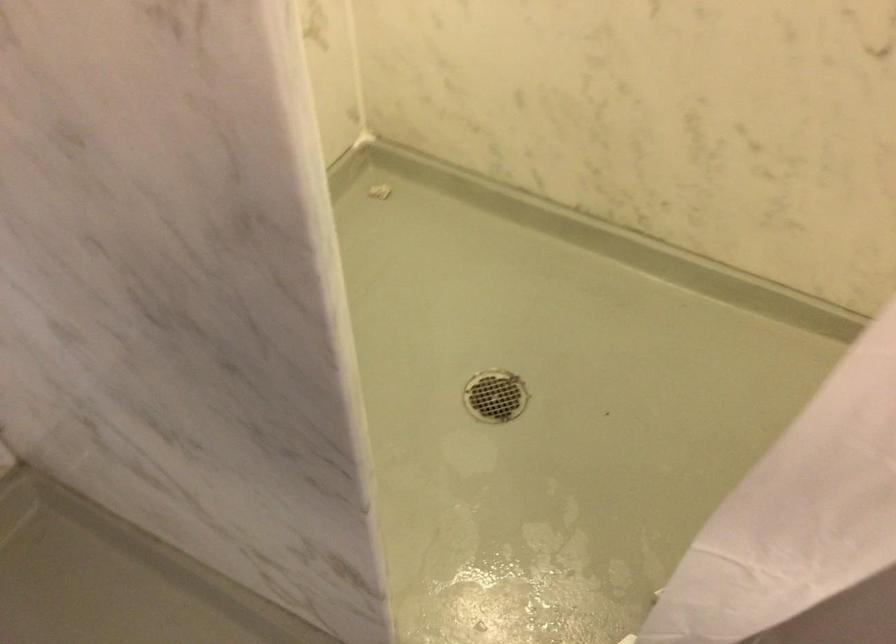
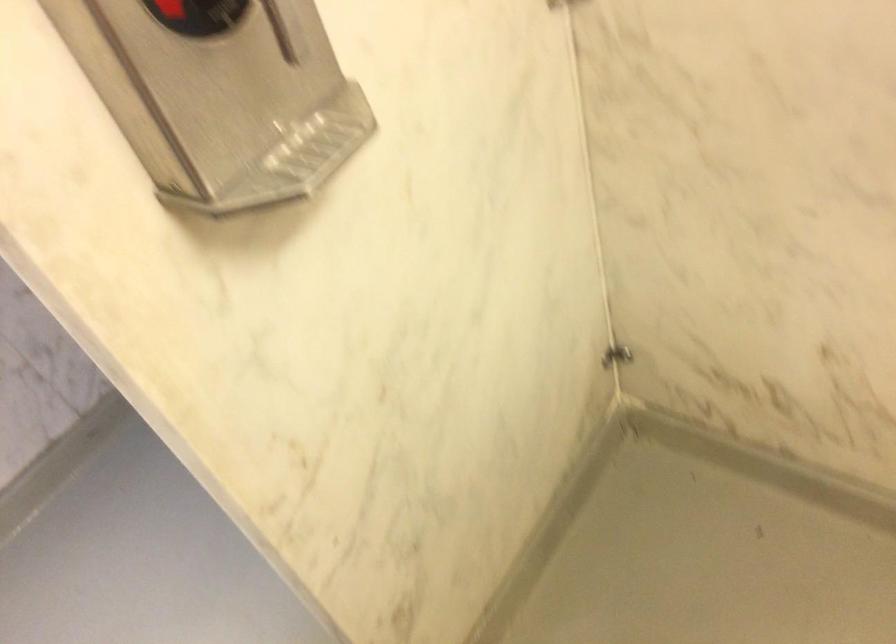
The images are taken continuously from a first-person perspective. In which direction is your viewpoint rotating?

The rotation direction of the camera is left-down.